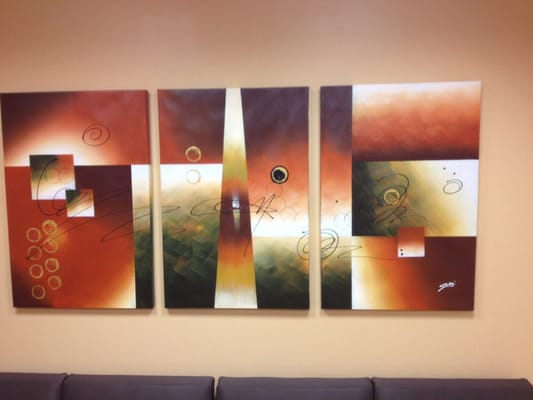
I want to click on tan wall, so click(x=482, y=338).